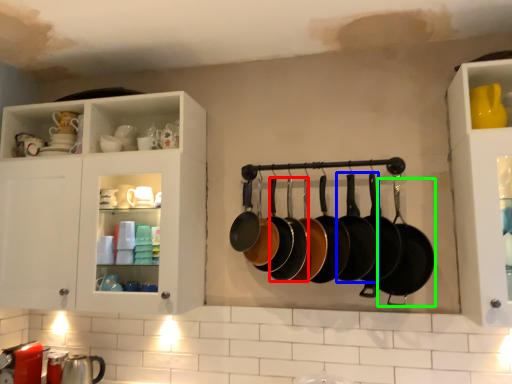
Question: Considering the real-world distances, which object is farthest from frying pan (highlighted by a red box)? frying pan (highlighted by a blue box) or frying pan (highlighted by a green box)?

Choices:
 (A) frying pan
 (B) frying pan

Answer: (B)